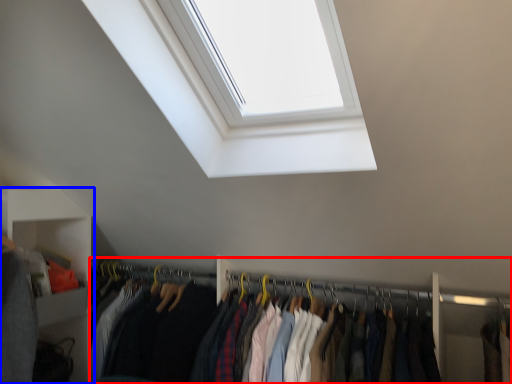
Question: Which point is closer to the camera, closet (highlighted by a red box) or shelf (highlighted by a blue box)?

Choices:
 (A) closet
 (B) shelf

Answer: (A)